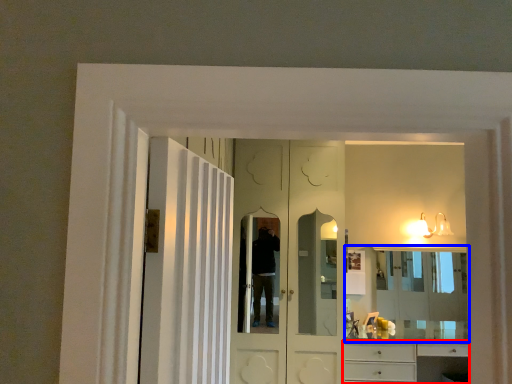
Question: Which object appears farthest to the camera in this image, cabinetry (highlighted by a red box) or mirror (highlighted by a blue box)?

Choices:
 (A) cabinetry
 (B) mirror

Answer: (B)